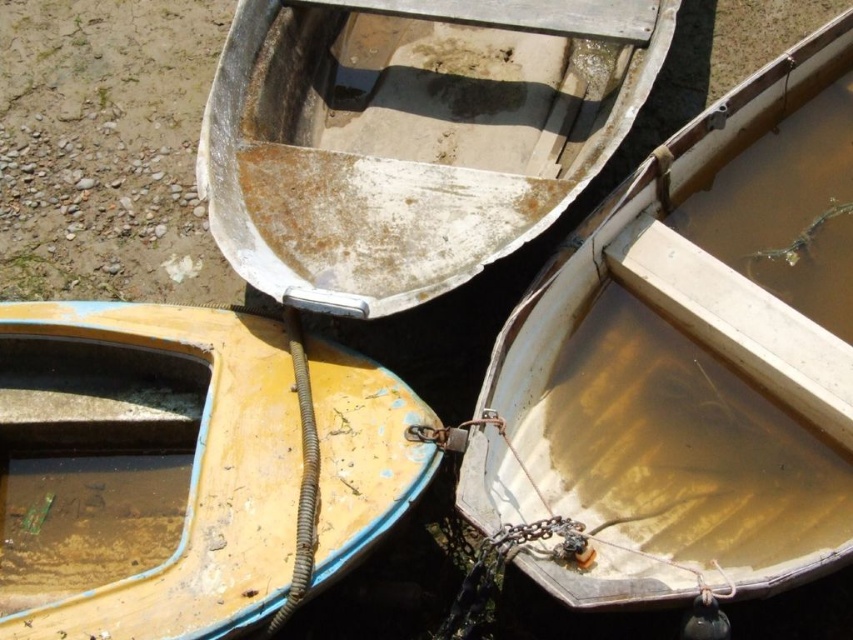
Question: Which of the following is the farthest from the observer?

Choices:
 (A) yellow matte boat at lower left
 (B) white weathered wood boat at upper center
 (C) wooden boat at center

Answer: (B)

Question: Which of the following is the farthest from the observer?

Choices:
 (A) white weathered wood boat at upper center
 (B) wooden boat at center
 (C) yellow matte boat at lower left

Answer: (A)

Question: Is yellow matte boat at lower left wider than wooden boat at center?

Choices:
 (A) yes
 (B) no

Answer: (B)

Question: Does white weathered wood boat at upper center have a smaller size compared to wooden boat at center?

Choices:
 (A) yes
 (B) no

Answer: (A)

Question: Does yellow matte boat at lower left appear on the right side of white weathered wood boat at upper center?

Choices:
 (A) yes
 (B) no

Answer: (B)

Question: Which point appears closest to the camera in this image?

Choices:
 (A) (349, 273)
 (B) (88, 532)

Answer: (B)